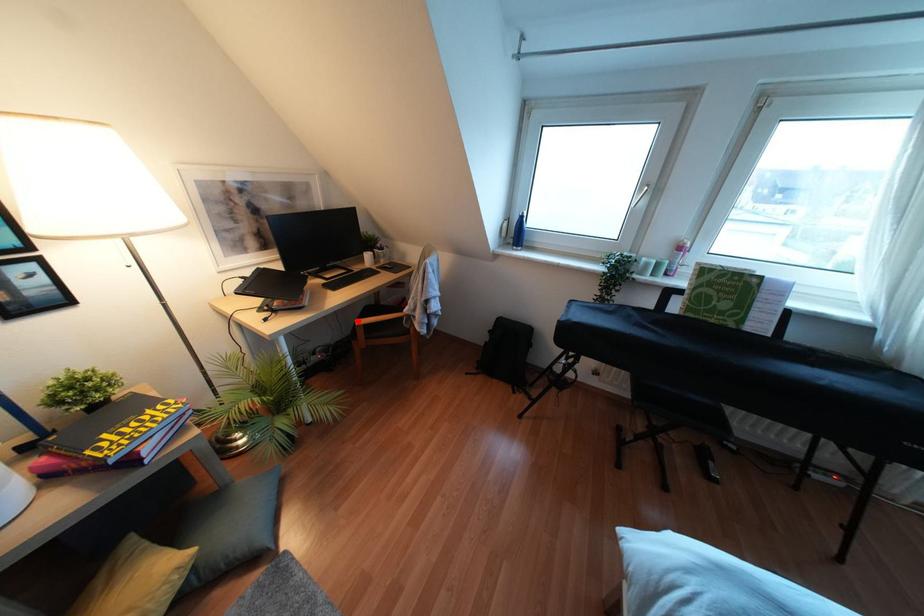
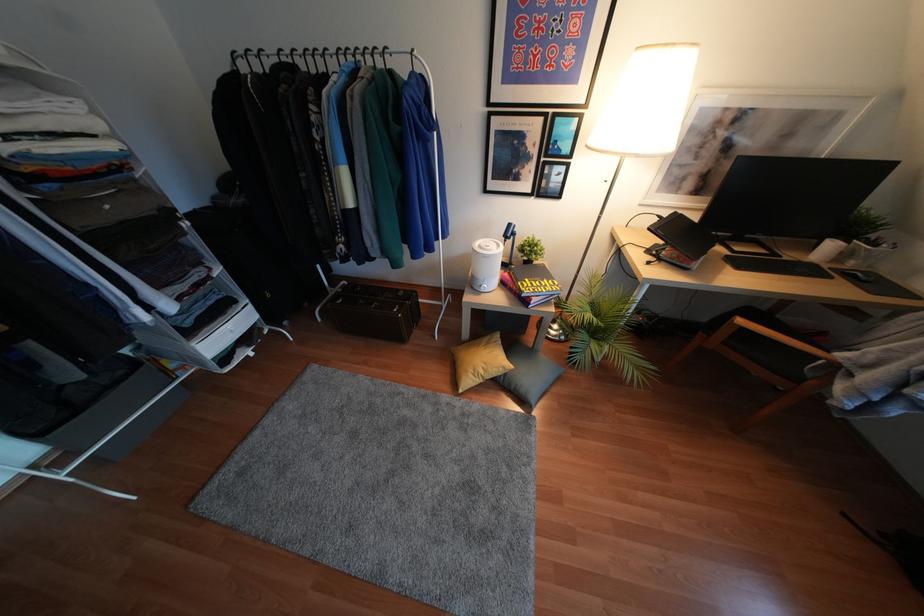
The point at the highlighted location is marked in the first image. Where is the corresponding point in the second image?

(739, 321)